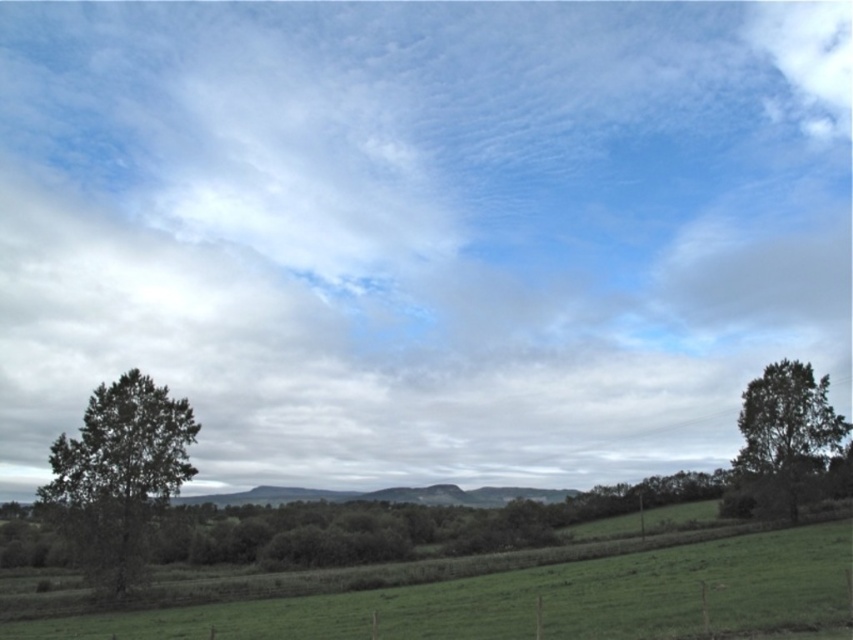
You are a hiker standing on the green grassy field at lower center and want to reach the green leafy tree at right. Which direction should you move to get closer to the tree?

The green grassy field at lower center is located above the green leafy tree at right, so you should move downward to reach the tree.

You are a drone operator trying to capture a photo of the green grassy field at lower center. The drone is currently hovering at point A, which is at coordinates (526, 596). Can you confirm if the drone is positioned correctly over the green grassy field at lower center?

The green grassy field at lower center is represented by point (526, 596), so yes, the drone is positioned correctly over the green grassy field at lower center.